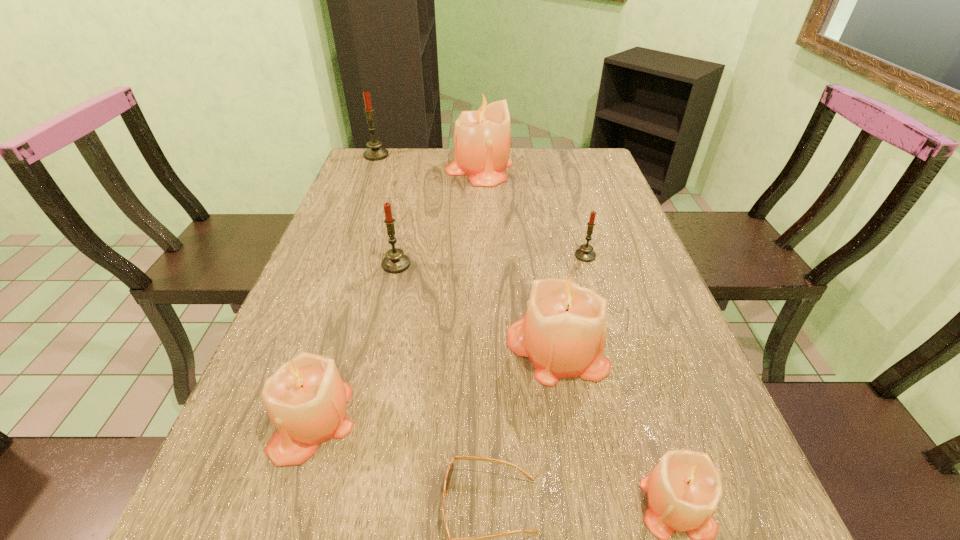
Identify the location of free spot between the third biggest beige candle and the farthest beige candle. (396, 294).

Locate an element on the screen. The width and height of the screenshot is (960, 540). vacant region between the smallest red candle and the farthest red candle is located at coordinates (481, 205).

The width and height of the screenshot is (960, 540). I want to click on free spot between the third biggest beige candle and the smallest red candle, so click(x=448, y=338).

This screenshot has height=540, width=960. I want to click on free space between the biggest beige candle and the second red candle from left to right, so click(x=438, y=216).

At what (x,y) coordinates should I click in order to perform the action: click on vacant space that's between the biggest beige candle and the farthest red candle. Please return your answer as a coordinate pair (x, y). Image resolution: width=960 pixels, height=540 pixels. Looking at the image, I should click on [x=427, y=161].

Image resolution: width=960 pixels, height=540 pixels. Find the location of `object that is the second closest to the biggest red candle`. object that is the second closest to the biggest red candle is located at coordinates (395, 261).

The height and width of the screenshot is (540, 960). Identify the location of object that is the fifth nearest to the smallest beige candle. (395, 261).

At what (x,y) coordinates should I click in order to perform the action: click on candle that can be found as the third closest to the farthest beige candle. Please return your answer as a coordinate pair (x, y). Image resolution: width=960 pixels, height=540 pixels. Looking at the image, I should click on (395, 261).

Identify which candle is located as the fifth nearest to the sunglasses. Please provide its 2D coordinates. Your answer should be formatted as a tuple, i.e. [(x, y)], where the tuple contains the x and y coordinates of a point satisfying the conditions above.

[(585, 253)]

Locate an element on the screen. the second closest beige candle to the smallest beige candle is located at coordinates (306, 398).